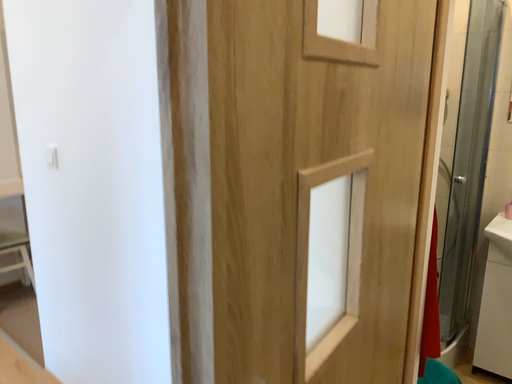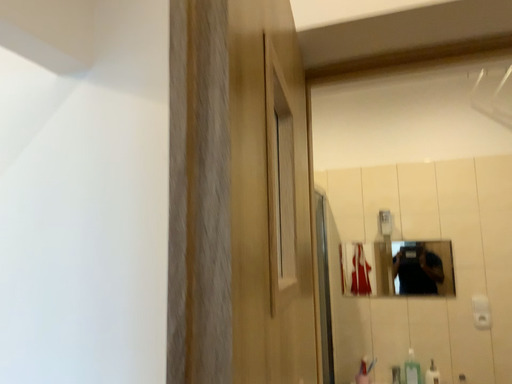
Question: How did the camera likely rotate when shooting the video?

Choices:
 (A) rotated upward
 (B) rotated downward

Answer: (A)